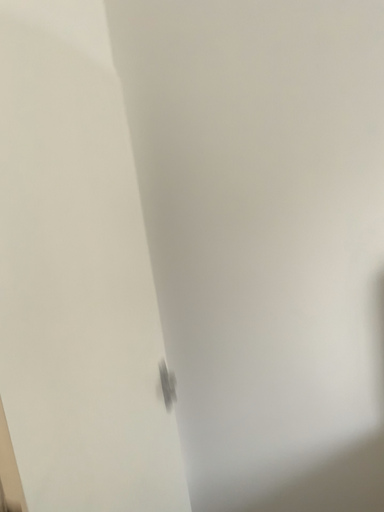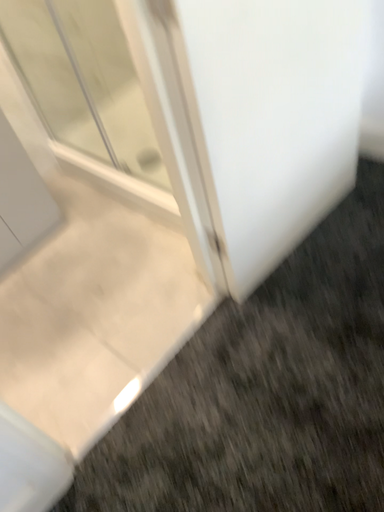
Question: Which way did the camera rotate in the video?

Choices:
 (A) rotated left
 (B) rotated right

Answer: (A)